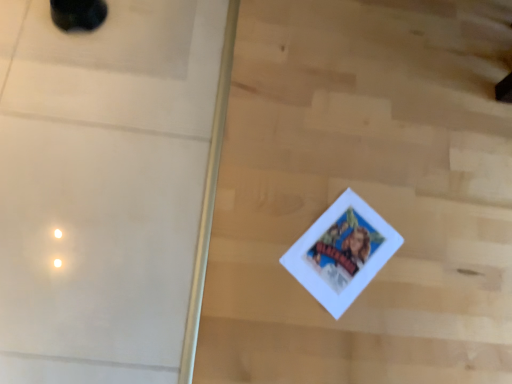
What are the coordinates of `space that is in front of black rubber shoe at upper left` in the screenshot? It's located at (56, 60).